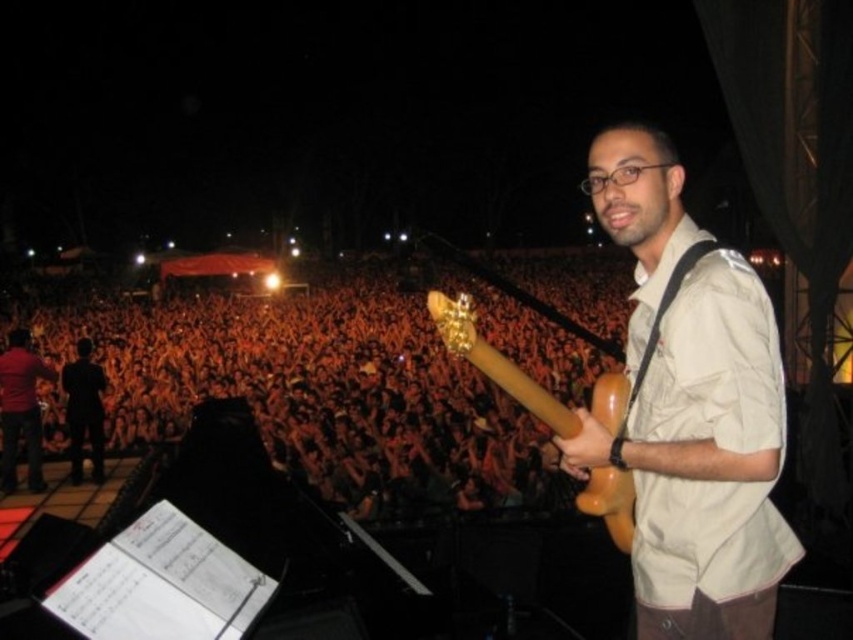
Who is taller, dark orange fabric crowd at left or matte brown guitar at center?

dark orange fabric crowd at left

Can you confirm if dark orange fabric crowd at left is positioned to the left of matte brown guitar at center?

Yes, dark orange fabric crowd at left is to the left of matte brown guitar at center.

Which is behind, point (152, 340) or point (631, 419)?

Positioned behind is point (152, 340).

Identify the location of dark orange fabric crowd at left. (312, 388).

Which of these two, woodenwoodenguitar at right or red shirt at left, stands taller?

red shirt at left is taller.

The height and width of the screenshot is (640, 853). I want to click on woodenwoodenguitar at right, so click(496, 362).

This screenshot has height=640, width=853. In order to click on woodenwoodenguitar at right in this screenshot , I will do `click(496, 362)`.

Describe the element at coordinates (312, 388) in the screenshot. The image size is (853, 640). I see `dark orange fabric crowd at left` at that location.

Does point (399, 465) come farther from viewer compared to point (631, 506)?

Yes, it is.

What do you see at coordinates (312, 388) in the screenshot?
I see `dark orange fabric crowd at left` at bounding box center [312, 388].

You are a GUI agent. You are given a task and a screenshot of the screen. Output one action in this format:
    pyautogui.click(x=<x>, y=<y>)
    Task: Click on the dark orange fabric crowd at left
    Image resolution: width=853 pixels, height=640 pixels.
    Given the screenshot: What is the action you would take?
    pyautogui.click(x=312, y=388)